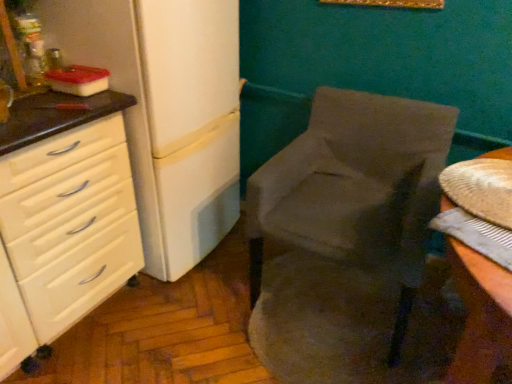
Measure the distance between point [94,217] and camera.

4.89 feet.

From the picture: In order to face white matte refrigerator at left, should I rotate leftwards or rightwards?

You should rotate left by 13.180 degrees.

Locate an element on the screen. The height and width of the screenshot is (384, 512). white matte refrigerator at left is located at coordinates (167, 112).

This screenshot has height=384, width=512. What are the coordinates of `velvet gray chair at center` in the screenshot? It's located at (358, 187).

Find the location of a particular element. white glossy chest of drawers at left is located at coordinates (63, 234).

Is white matte refrigerator at left located outside velvet gray chair at center?

That's correct, white matte refrigerator at left is outside of velvet gray chair at center.

Is white matte refrigerator at left to the left of velvet gray chair at center from the viewer's perspective?

Yes, white matte refrigerator at left is to the left of velvet gray chair at center.

From the image's perspective, between white matte refrigerator at left and velvet gray chair at center, which one is located above?

From the image's view, white matte refrigerator at left is above.

From the image's perspective, does white matte refrigerator at left appear lower than white glossy chest of drawers at left?

No.

From a real-world perspective, who is located higher, white matte refrigerator at left or white glossy chest of drawers at left?

From a 3D spatial view, white matte refrigerator at left is above.

Is white matte refrigerator at left looking in the opposite direction of white glossy chest of drawers at left?

No, white matte refrigerator at left's orientation is not away from white glossy chest of drawers at left.

Is the depth of white glossy chest of drawers at left greater than that of velvet gray chair at center?

That is False.

Can you confirm if white glossy chest of drawers at left is positioned to the left of velvet gray chair at center?

Indeed, white glossy chest of drawers at left is positioned on the left side of velvet gray chair at center.

Considering the positions of points (125, 216) and (372, 181), is point (125, 216) closer to camera compared to point (372, 181)?

Yes, it is in front of point (372, 181).

From a real-world perspective, which object rests below the other?

From a 3D spatial view, velvet gray chair at center is below.

Which object is further away from the camera, white glossy chest of drawers at left or white matte refrigerator at left?

white matte refrigerator at left is further from the camera.

Does white glossy chest of drawers at left appear on the left side of white matte refrigerator at left?

Yes.

Based on the photo, between white glossy chest of drawers at left and white matte refrigerator at left, which one has smaller width?

With smaller width is white matte refrigerator at left.

From the image's perspective, which is below, velvet gray chair at center or white glossy chest of drawers at left?

white glossy chest of drawers at left appears lower in the image.

Is velvet gray chair at center surrounding white glossy chest of drawers at left?

Definitely not — white glossy chest of drawers at left is not inside velvet gray chair at center.

From a real-world perspective, is velvet gray chair at center physically above white glossy chest of drawers at left?

No, from a real-world perspective, velvet gray chair at center is not on top of white glossy chest of drawers at left.

Locate an element on the screen. The width and height of the screenshot is (512, 384). chair that is on the right side of white glossy chest of drawers at left is located at coordinates (358, 187).

How many degrees apart are the facing directions of velvet gray chair at center and white matte refrigerator at left?

95.4 degrees.

Locate an element on the screen. refrigerator located on the left of velvet gray chair at center is located at coordinates (167, 112).

In terms of height, does velvet gray chair at center look taller or shorter compared to white matte refrigerator at left?

Clearly, velvet gray chair at center is shorter compared to white matte refrigerator at left.

Which object is closer to the camera taking this photo, velvet gray chair at center or white matte refrigerator at left?

Positioned in front is velvet gray chair at center.

The width and height of the screenshot is (512, 384). Find the location of `refrigerator positioned vertically above the velvet gray chair at center (from a real-world perspective)`. refrigerator positioned vertically above the velvet gray chair at center (from a real-world perspective) is located at coordinates (167, 112).

Locate an element on the screen. This screenshot has width=512, height=384. chest of drawers lying on the left of white matte refrigerator at left is located at coordinates (63, 234).

Considering their positions, is white glossy chest of drawers at left positioned further to white matte refrigerator at left than velvet gray chair at center?

velvet gray chair at center lies further to white matte refrigerator at left than the other object.

When comparing their distances from white glossy chest of drawers at left, does velvet gray chair at center or white matte refrigerator at left seem closer?

The object closer to white glossy chest of drawers at left is white matte refrigerator at left.

When comparing their distances from white glossy chest of drawers at left, does white matte refrigerator at left or velvet gray chair at center seem further?

Based on the image, velvet gray chair at center appears to be further to white glossy chest of drawers at left.

Looking at the image, which one is located further to white matte refrigerator at left, velvet gray chair at center or white glossy chest of drawers at left?

velvet gray chair at center is positioned further to the anchor white matte refrigerator at left.

Looking at the image, which one is located further to velvet gray chair at center, white glossy chest of drawers at left or white matte refrigerator at left?

white glossy chest of drawers at left is further to velvet gray chair at center.

From the image, which object appears to be nearer to velvet gray chair at center, white matte refrigerator at left or white glossy chest of drawers at left?

Based on the image, white matte refrigerator at left appears to be nearer to velvet gray chair at center.

Identify the location of refrigerator located between white glossy chest of drawers at left and velvet gray chair at center in the left-right direction. This screenshot has height=384, width=512. (167, 112).